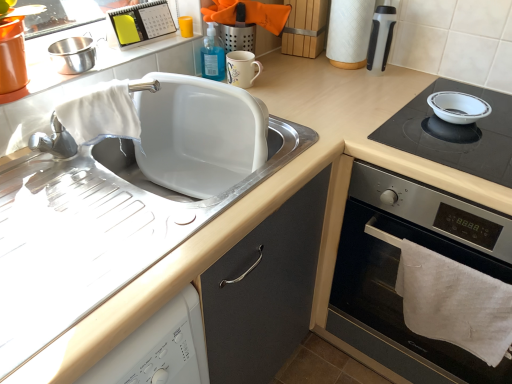
Find the location of a particular element. white matte sink at left is located at coordinates (173, 133).

Where is `black glass cooktop at right`? The width and height of the screenshot is (512, 384). black glass cooktop at right is located at coordinates (397, 272).

Image resolution: width=512 pixels, height=384 pixels. What do you see at coordinates (242, 68) in the screenshot? I see `matte ceramic mug at upper center, acting as the third appliance starting from the left` at bounding box center [242, 68].

I want to click on matte ceramic mug at upper center, the 2th appliance in the right-to-left sequence, so click(242, 68).

This screenshot has height=384, width=512. What do you see at coordinates (134, 51) in the screenshot?
I see `white matte sink at upper left` at bounding box center [134, 51].

Find the location of `white cotton towel at lower right`. white cotton towel at lower right is located at coordinates (454, 303).

The height and width of the screenshot is (384, 512). What do you see at coordinates (140, 23) in the screenshot?
I see `white plastic calendar at upper center, the second appliance when ordered from left to right` at bounding box center [140, 23].

Identify the location of stainless steel bowl at upper left, the first appliance from the left. (73, 55).

Consider the image. Between white matte sink at left and white paper towel at upper right, which one is positioned in front?

white matte sink at left is in front.

Consider the image. Is white matte sink at left looking in the opposite direction of white paper towel at upper right?

No, white matte sink at left is not facing away from white paper towel at upper right.

Can you confirm if white matte sink at left is positioned to the right of white paper towel at upper right?

No.

Is point (152, 145) closer or farther from the camera than point (356, 25)?

Point (152, 145).

Locate an element on the screen. Image resolution: width=512 pixels, height=384 pixels. gas stove that is under the matte ceramic mug at upper center, acting as the third appliance starting from the left (from a real-world perspective) is located at coordinates (455, 134).

In the scene shown: Is white glossy bowl at upper right aimed at matte ceramic mug at upper center, the 2th appliance in the right-to-left sequence?

No, white glossy bowl at upper right does not turn towards matte ceramic mug at upper center, the 2th appliance in the right-to-left sequence.

Which is behind, white glossy bowl at upper right or matte ceramic mug at upper center, the 2th appliance in the right-to-left sequence?

matte ceramic mug at upper center, the 2th appliance in the right-to-left sequence, is behind.

Which point is more forward, (83, 47) or (359, 46)?

The point (83, 47) is closer.

From a real-world perspective, which is physically below, stainless steel bowl at upper left, the first appliance from the left, or white paper towel at upper right?

stainless steel bowl at upper left, the first appliance from the left, is physically lower.

Considering the relative sizes of stainless steel bowl at upper left, the first appliance from the left, and white paper towel at upper right in the image provided, is stainless steel bowl at upper left, the first appliance from the left, wider than white paper towel at upper right?

Correct, the width of stainless steel bowl at upper left, the first appliance from the left, exceeds that of white paper towel at upper right.

Is stainless steel bowl at upper left, the 4th appliance in the right-to-left sequence, to the left or to the right of white paper towel at upper right in the image?

In the image, stainless steel bowl at upper left, the 4th appliance in the right-to-left sequence, appears on the left side of white paper towel at upper right.

From the image's perspective, is white plastic calendar at upper center, the 3th appliance positioned from the right, over matte black thermos at upper right, acting as the fourth appliance starting from the left?

Yes, from the image's perspective, white plastic calendar at upper center, the 3th appliance positioned from the right, is over matte black thermos at upper right, acting as the fourth appliance starting from the left.

Which of these two, white plastic calendar at upper center, the second appliance when ordered from left to right, or matte black thermos at upper right, positioned as the 1th appliance in right-to-left order, is smaller?

Smaller between the two is matte black thermos at upper right, positioned as the 1th appliance in right-to-left order.

Is matte black thermos at upper right, acting as the fourth appliance starting from the left, a part of white plastic calendar at upper center, the 3th appliance positioned from the right?

No, matte black thermos at upper right, acting as the fourth appliance starting from the left, is not a part of white plastic calendar at upper center, the 3th appliance positioned from the right.

Does white plastic calendar at upper center, the 3th appliance positioned from the right, lie in front of matte black thermos at upper right, positioned as the 1th appliance in right-to-left order?

Yes, white plastic calendar at upper center, the 3th appliance positioned from the right, is closer to the camera.

Considering the relative sizes of white cotton towel at lower right and white matte sink at upper left in the image provided, is white cotton towel at lower right thinner than white matte sink at upper left?

Yes.

Between white cotton towel at lower right and white matte sink at upper left, which one appears on the right side from the viewer's perspective?

Positioned to the right is white cotton towel at lower right.

Which of these two, white cotton towel at lower right or white matte sink at upper left, is bigger?

Bigger between the two is white matte sink at upper left.

From the image's perspective, would you say white cotton towel at lower right is positioned over white matte sink at upper left?

Actually, white cotton towel at lower right appears below white matte sink at upper left in the image.

Is white plastic calendar at upper center, the 3th appliance positioned from the right, further to camera compared to white glossy bowl at upper right?

Yes, white plastic calendar at upper center, the 3th appliance positioned from the right, is further from the viewer.

From the image's perspective, relative to white glossy bowl at upper right, is white plastic calendar at upper center, the second appliance when ordered from left to right, above or below?

Based on their image positions, white plastic calendar at upper center, the second appliance when ordered from left to right, is located above white glossy bowl at upper right.

What's the angular difference between white plastic calendar at upper center, the 3th appliance positioned from the right, and white glossy bowl at upper right's facing directions?

89.8 degrees.

Is white plastic calendar at upper center, the 3th appliance positioned from the right, beside white glossy bowl at upper right?

No, white plastic calendar at upper center, the 3th appliance positioned from the right, is not next to white glossy bowl at upper right.

Is white plastic calendar at upper center, the 3th appliance positioned from the right, taller than white cotton towel at lower right?

No, white plastic calendar at upper center, the 3th appliance positioned from the right, is not taller than white cotton towel at lower right.

Can you confirm if white plastic calendar at upper center, the 3th appliance positioned from the right, is thinner than white cotton towel at lower right?

Indeed, white plastic calendar at upper center, the 3th appliance positioned from the right, has a lesser width compared to white cotton towel at lower right.

From the image's perspective, is white plastic calendar at upper center, the second appliance when ordered from left to right, on top of white cotton towel at lower right?

Indeed, from the image's perspective, white plastic calendar at upper center, the second appliance when ordered from left to right, is shown above white cotton towel at lower right.

Are white plastic calendar at upper center, the 3th appliance positioned from the right, and white cotton towel at lower right located far from each other?

Yes, white plastic calendar at upper center, the 3th appliance positioned from the right, and white cotton towel at lower right are quite far apart.

At what (x,y) coordinates should I click in order to perform the action: click on sink in front of the white paper towel at upper right. Please return your answer as a coordinate pair (x, y). Looking at the image, I should click on (173, 133).

In the image, there is a matte ceramic mug at upper center, acting as the third appliance starting from the left. Where is `gas stove below it (from a real-world perspective)`? gas stove below it (from a real-world perspective) is located at coordinates (455, 134).

From the image, which object appears to be nearer to matte black thermos at upper right, positioned as the 1th appliance in right-to-left order, matte ceramic mug at upper center, the 2th appliance in the right-to-left sequence, or stainless steel bowl at upper left, the 4th appliance in the right-to-left sequence?

matte ceramic mug at upper center, the 2th appliance in the right-to-left sequence, lies closer to matte black thermos at upper right, positioned as the 1th appliance in right-to-left order, than the other object.

Which object lies further to the anchor point matte black thermos at upper right, acting as the fourth appliance starting from the left, stainless steel bowl at upper left, the first appliance from the left, or black glass cooktop at right?

stainless steel bowl at upper left, the first appliance from the left, lies further to matte black thermos at upper right, acting as the fourth appliance starting from the left, than the other object.

Looking at the image, which one is located further to matte black thermos at upper right, positioned as the 1th appliance in right-to-left order, white glossy bowl at upper right or white matte sink at left?

white matte sink at left lies further to matte black thermos at upper right, positioned as the 1th appliance in right-to-left order, than the other object.

From the image, which object appears to be farther from black glass cooktop at right, white matte sink at upper left or matte ceramic mug at upper center, acting as the third appliance starting from the left?

The object further to black glass cooktop at right is white matte sink at upper left.

From the image, which object appears to be farther from stainless steel bowl at upper left, the first appliance from the left, white plastic calendar at upper center, the second appliance when ordered from left to right, or black glass cooktop at right?

black glass cooktop at right lies further to stainless steel bowl at upper left, the first appliance from the left, than the other object.

Considering their positions, is stainless steel bowl at upper left, the 4th appliance in the right-to-left sequence, positioned closer to white cotton towel at lower right than white glossy bowl at upper right?

white glossy bowl at upper right is closer to white cotton towel at lower right.

From the image, which object appears to be farther from matte ceramic mug at upper center, acting as the third appliance starting from the left, white glossy bowl at upper right or white matte sink at left?

white glossy bowl at upper right lies further to matte ceramic mug at upper center, acting as the third appliance starting from the left, than the other object.

Estimate the real-world distances between objects in this image. Which object is closer to white paper towel at upper right, white plastic calendar at upper center, the 3th appliance positioned from the right, or stainless steel bowl at upper left, the first appliance from the left?

white plastic calendar at upper center, the 3th appliance positioned from the right.

This screenshot has height=384, width=512. Find the location of `bath towel between stainless steel bowl at upper left, the first appliance from the left, and black glass cooktop at right`. bath towel between stainless steel bowl at upper left, the first appliance from the left, and black glass cooktop at right is located at coordinates (454, 303).

What are the coordinates of `counter top between stainless steel bowl at upper left, the 4th appliance in the right-to-left sequence, and black glass cooktop at right, in the horizontal direction` in the screenshot? It's located at (134, 51).

Image resolution: width=512 pixels, height=384 pixels. I want to click on sink between white plastic calendar at upper center, the second appliance when ordered from left to right, and white glossy bowl at upper right from left to right, so click(x=173, y=133).

The image size is (512, 384). In order to click on sink located between stainless steel bowl at upper left, the 4th appliance in the right-to-left sequence, and matte black thermos at upper right, acting as the fourth appliance starting from the left, in the left-right direction in this screenshot , I will do `click(173, 133)`.